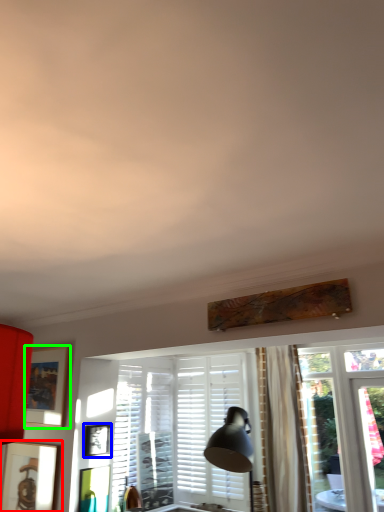
Question: Which is nearer to the picture frame (highlighted by a red box)? picture frame (highlighted by a blue box) or picture frame (highlighted by a green box).

Choices:
 (A) picture frame
 (B) picture frame

Answer: (B)